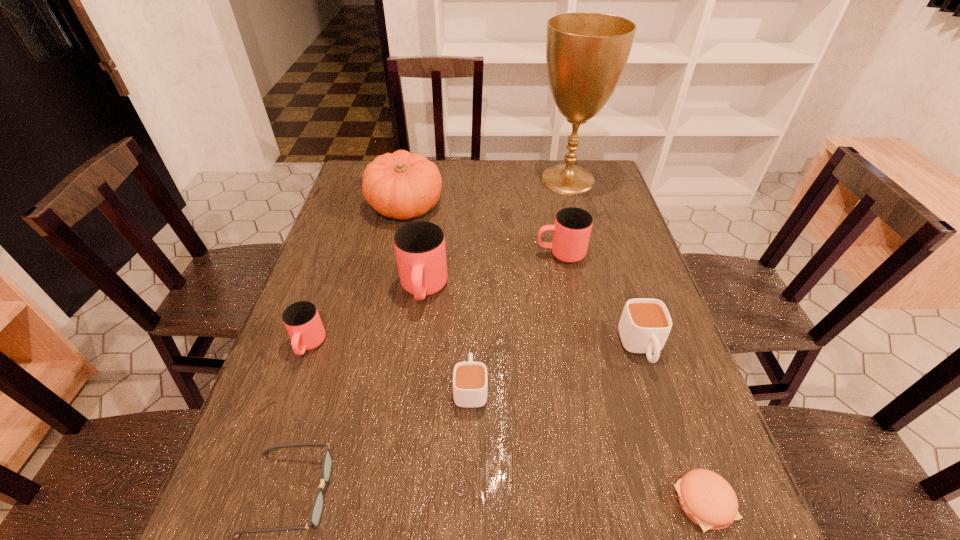
Where is `free space located on the handle side of the smallest pink cup`? free space located on the handle side of the smallest pink cup is located at coordinates tap(249, 518).

The image size is (960, 540). I want to click on vacant area located on the side with the handle of the right white cup, so [x=702, y=535].

At what (x,y) coordinates should I click in order to perform the action: click on vacant space located 0.250m on the side with the handle of the third shortest object. Please return your answer as a coordinate pair (x, y). The height and width of the screenshot is (540, 960). Looking at the image, I should click on tap(472, 287).

Where is `vacant position located 0.380m on the side with the handle of the third shortest object`? Image resolution: width=960 pixels, height=540 pixels. vacant position located 0.380m on the side with the handle of the third shortest object is located at coordinates (473, 255).

Image resolution: width=960 pixels, height=540 pixels. What are the coordinates of `free location located 0.080m on the side with the handle of the third shortest object` in the screenshot? It's located at (471, 338).

At what (x,y) coordinates should I click in order to perform the action: click on vacant space located on the face of the gray spectacles. Please return your answer as a coordinate pair (x, y). This screenshot has height=540, width=960. Looking at the image, I should click on (523, 493).

Find the location of a particular element. vacant space located 0.220m on the back of the patty is located at coordinates (660, 373).

This screenshot has width=960, height=540. Find the location of `trophy cup that is at the far edge`. trophy cup that is at the far edge is located at coordinates (586, 52).

At what (x,y) coordinates should I click in order to perform the action: click on pumpkin that is at the far edge. Please return your answer as a coordinate pair (x, y). Looking at the image, I should click on (401, 185).

Identify the location of spectacles that is at the near edge. (317, 507).